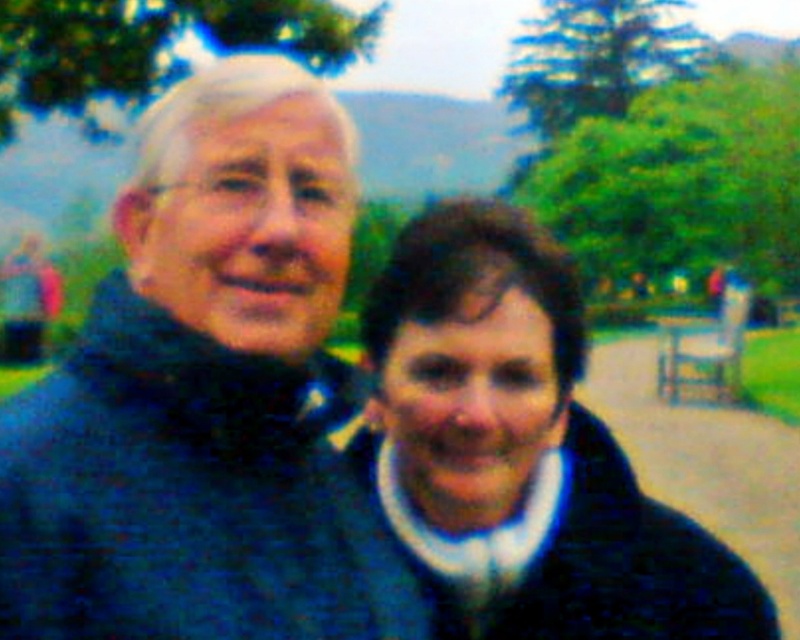
Question: Which point is closer to the camera?

Choices:
 (A) (780, 572)
 (B) (608, 637)

Answer: (B)

Question: Is dark blue jacket at center above brown wooden bench at center?

Choices:
 (A) no
 (B) yes

Answer: (B)

Question: Among these points, which one is farthest from the camera?

Choices:
 (A) (774, 484)
 (B) (720, 602)

Answer: (A)

Question: In this image, where is dark blue jacket at center located relative to brown wooden bench at center?

Choices:
 (A) above
 (B) below

Answer: (A)

Question: Does dark blue jacket at center appear on the right side of brown wooden bench at center?

Choices:
 (A) no
 (B) yes

Answer: (A)

Question: Among these points, which one is nearest to the camera?

Choices:
 (A) pos(790,524)
 (B) pos(494,540)

Answer: (B)